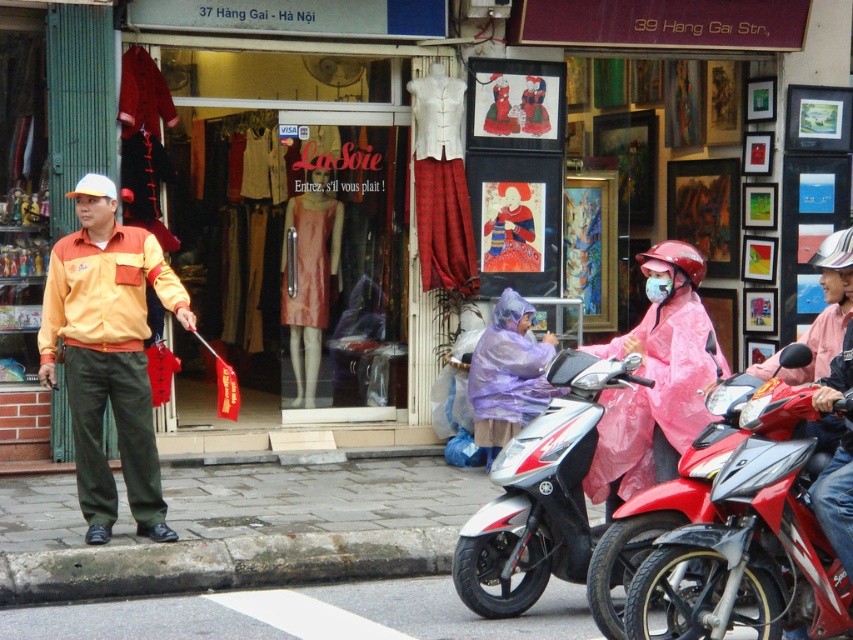
Based on the photo, does matte pink dress at center have a larger size compared to purple matte raincoat at center?

Yes, matte pink dress at center is bigger than purple matte raincoat at center.

Which of these two, matte pink dress at center or purple matte raincoat at center, stands taller?

matte pink dress at center is taller.

Is point (308, 326) closer to camera compared to point (498, 433)?

No, it is not.

The height and width of the screenshot is (640, 853). Identify the location of matte pink dress at center. (309, 276).

Can you confirm if orange fabric shirt at left is positioned below matte pink dress at center?

Yes.

Is orange fabric shirt at left taller than matte pink dress at center?

Indeed, orange fabric shirt at left has a greater height compared to matte pink dress at center.

Is point (65, 250) farther from viewer compared to point (332, 237)?

No, (65, 250) is closer to viewer.

The width and height of the screenshot is (853, 640). In order to click on orange fabric shirt at left in this screenshot , I will do `click(108, 353)`.

Is red glossy motorcycle at right shorter than purple matte raincoat at center?

Indeed, red glossy motorcycle at right has a lesser height compared to purple matte raincoat at center.

Is red glossy motorcycle at right wider than purple matte raincoat at center?

Indeed, red glossy motorcycle at right has a greater width compared to purple matte raincoat at center.

Is point (689, 451) behind point (482, 392)?

That is False.

Identify the location of red glossy motorcycle at right. Image resolution: width=853 pixels, height=640 pixels. (665, 502).